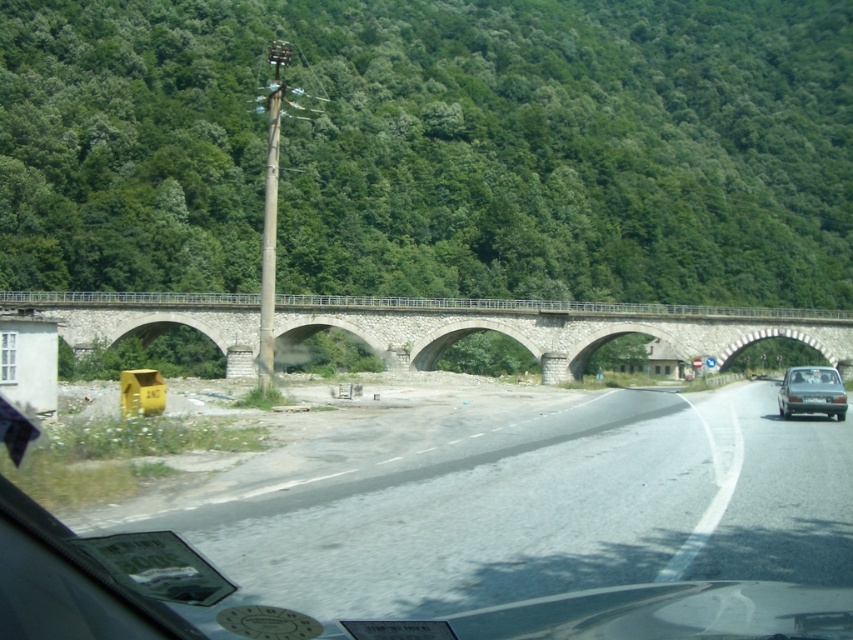
Who is more forward, (567,461) or (263,332)?

Point (567,461) is in front.

Between asphalt road at center and metallic pole at center-left, which one is positioned lower?

Positioned lower is asphalt road at center.

Based on the photo, measure the distance between asphalt road at center and camera.

The distance of asphalt road at center from camera is 4.99 meters.

You are a GUI agent. You are given a task and a screenshot of the screen. Output one action in this format:
    pyautogui.click(x=<x>, y=<y>)
    Task: Click on the asphalt road at center
    
    Given the screenshot: What is the action you would take?
    pyautogui.click(x=531, y=506)

Does asphalt road at center come in front of silver metallic sedan at right?

Yes, it is.

Can you confirm if asphalt road at center is positioned to the left of silver metallic sedan at right?

Correct, you'll find asphalt road at center to the left of silver metallic sedan at right.

Measure the distance between asphalt road at center and camera.

A distance of 4.99 meters exists between asphalt road at center and camera.

I want to click on asphalt road at center, so click(x=531, y=506).

Is metallic pole at center-left wider than silver metallic sedan at right?

Yes, metallic pole at center-left is wider than silver metallic sedan at right.

Is point (271, 56) in front of point (782, 413)?

No, (271, 56) is behind (782, 413).

Describe the element at coordinates (270, 211) in the screenshot. I see `metallic pole at center-left` at that location.

At what (x,y) coordinates should I click in order to perform the action: click on metallic pole at center-left. Please return your answer as a coordinate pair (x, y). Looking at the image, I should click on (270, 211).